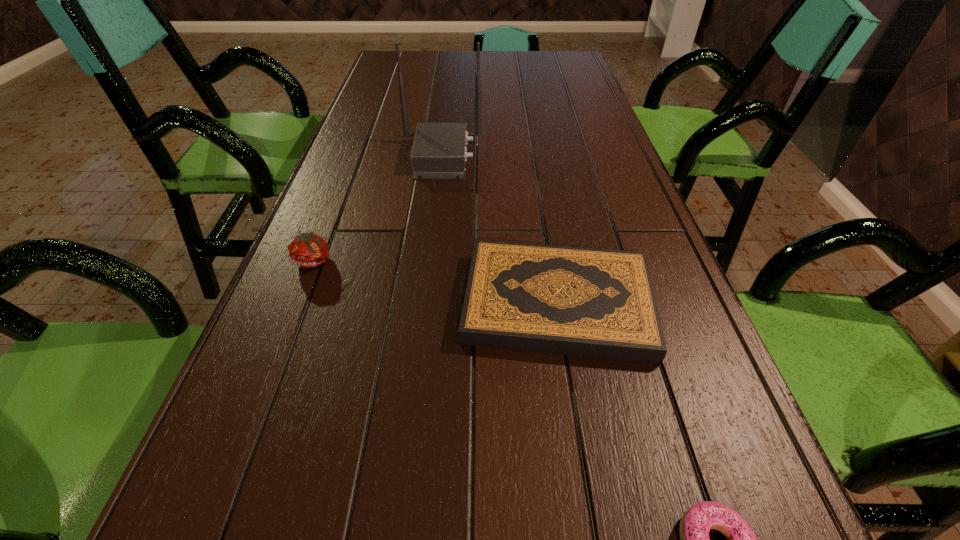
Where is `router`? The image size is (960, 540). router is located at coordinates (439, 150).

Find the location of a particular element. The height and width of the screenshot is (540, 960). the tallest object is located at coordinates (439, 150).

The width and height of the screenshot is (960, 540). I want to click on the leftmost object, so click(307, 250).

At what (x,y) coordinates should I click in order to perform the action: click on tomato. Please return your answer as a coordinate pair (x, y). This screenshot has width=960, height=540. Looking at the image, I should click on (307, 250).

Where is `hardback book`? The image size is (960, 540). hardback book is located at coordinates (599, 303).

You are a GUI agent. You are given a task and a screenshot of the screen. Output one action in this format:
    pyautogui.click(x=<x>, y=<y>)
    Task: Click on the free space located 0.330m on the back of the tallest object to connect cables
    This screenshot has width=960, height=540.
    Given the screenshot: What is the action you would take?
    pyautogui.click(x=606, y=156)

Locate an element on the screen. vacant space located on the right of the second tallest object is located at coordinates (515, 261).

Identify the location of vacant space situated 0.220m on the left of the hardback book. (340, 304).

Where is `object that is at the left edge`? This screenshot has height=540, width=960. object that is at the left edge is located at coordinates (307, 250).

This screenshot has width=960, height=540. I want to click on object that is at the right edge, so click(x=599, y=303).